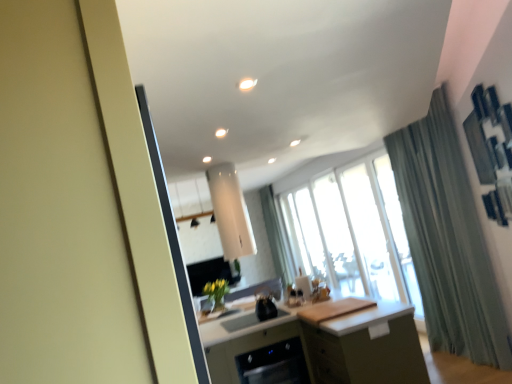
Locate an element on the screen. vacant space to the right of white glossy light at upper center is located at coordinates (283, 76).